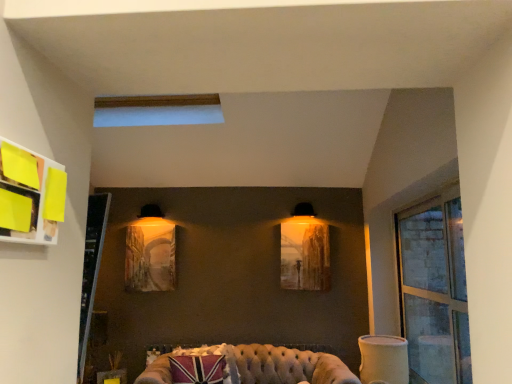
Question: Is matte glass picture frame at center, which appears as the 2th picture frame when viewed from the left, not near tufted leather couch at lower center?

Choices:
 (A) yes
 (B) no

Answer: (B)

Question: From the image's perspective, is matte glass picture frame at center, the first picture frame positioned from the right, above tufted leather couch at lower center?

Choices:
 (A) yes
 (B) no

Answer: (A)

Question: Is matte glass picture frame at center, the first picture frame positioned from the right, taller than tufted leather couch at lower center?

Choices:
 (A) yes
 (B) no

Answer: (A)

Question: Considering the relative sizes of matte glass picture frame at center, the first picture frame positioned from the right, and tufted leather couch at lower center in the image provided, is matte glass picture frame at center, the first picture frame positioned from the right, smaller than tufted leather couch at lower center?

Choices:
 (A) yes
 (B) no

Answer: (A)

Question: Does matte glass picture frame at center, the first picture frame positioned from the right, appear on the left side of tufted leather couch at lower center?

Choices:
 (A) yes
 (B) no

Answer: (B)

Question: Is point (290, 362) closer or farther from the camera than point (144, 241)?

Choices:
 (A) closer
 (B) farther

Answer: (A)

Question: Considering the positions of tufted leather couch at lower center and matte wooden picture frame at center, the 2th picture frame viewed from the right, in the image, is tufted leather couch at lower center bigger or smaller than matte wooden picture frame at center, the 2th picture frame viewed from the right,?

Choices:
 (A) big
 (B) small

Answer: (A)

Question: Is tufted leather couch at lower center situated inside matte wooden picture frame at center, the 2th picture frame viewed from the right, or outside?

Choices:
 (A) inside
 (B) outside

Answer: (B)

Question: From the image's perspective, is tufted leather couch at lower center above or below matte wooden picture frame at center, which is the first picture frame in left-to-right order?

Choices:
 (A) above
 (B) below

Answer: (B)

Question: Considering the positions of matte wooden picture frame at center, the 2th picture frame viewed from the right, and tufted leather couch at lower center in the image, is matte wooden picture frame at center, the 2th picture frame viewed from the right, wider or thinner than tufted leather couch at lower center?

Choices:
 (A) wide
 (B) thin

Answer: (B)

Question: In terms of height, does matte wooden picture frame at center, the 2th picture frame viewed from the right, look taller or shorter compared to tufted leather couch at lower center?

Choices:
 (A) tall
 (B) short

Answer: (A)

Question: In terms of size, does matte wooden picture frame at center, which is the first picture frame in left-to-right order, appear bigger or smaller than tufted leather couch at lower center?

Choices:
 (A) small
 (B) big

Answer: (A)

Question: In the image, is matte wooden picture frame at center, which is the first picture frame in left-to-right order, on the left side or the right side of tufted leather couch at lower center?

Choices:
 (A) left
 (B) right

Answer: (A)

Question: Considering their positions, is yellow paper at upper left located in front of or behind matte glass picture frame at center, the first picture frame positioned from the right?

Choices:
 (A) front
 (B) behind

Answer: (A)

Question: From a real-world perspective, relative to matte glass picture frame at center, which appears as the 2th picture frame when viewed from the left, is yellow paper at upper left vertically above or below?

Choices:
 (A) below
 (B) above

Answer: (B)